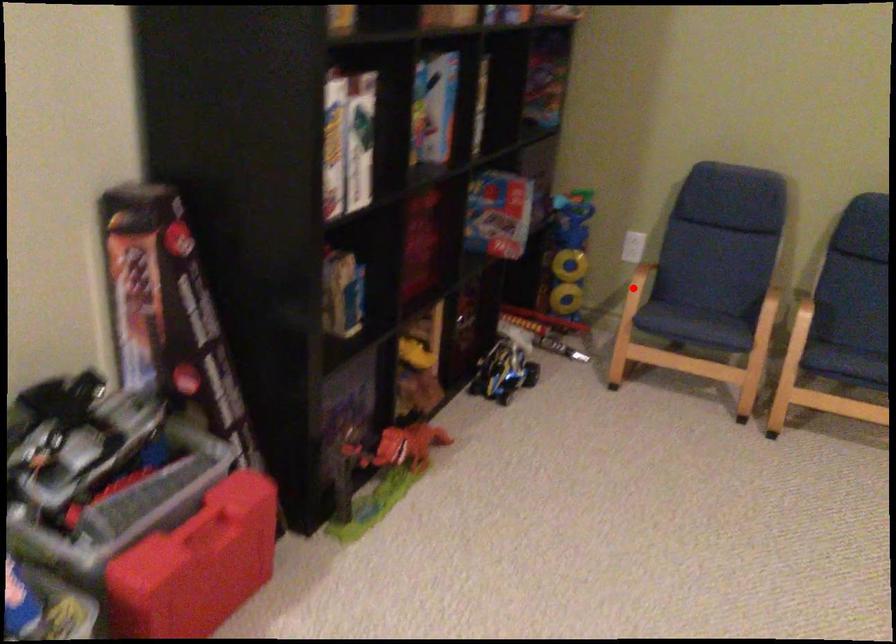
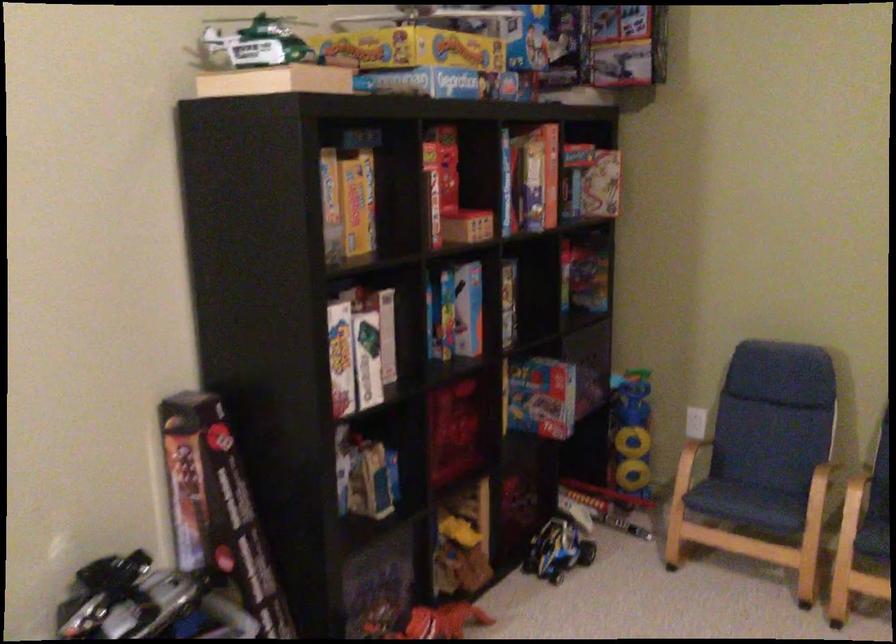
Where in the second image is the point corresponding to the highlighted location from the first image?

(683, 466)